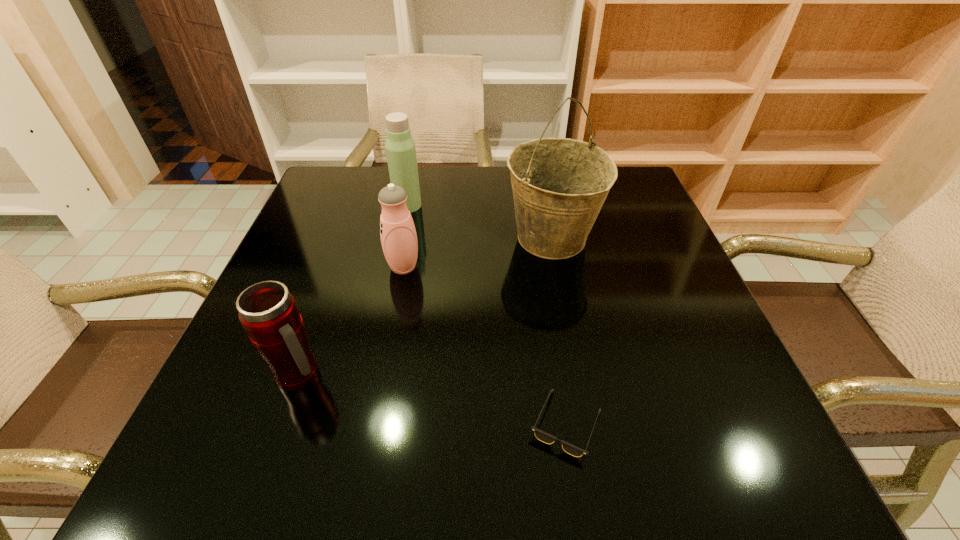
Where is `the tallest object`? The height and width of the screenshot is (540, 960). the tallest object is located at coordinates (559, 185).

I want to click on the farthest thermos bottle, so click(x=400, y=147).

I want to click on the second nearest thermos bottle, so click(398, 235).

Where is `the nearest thermos bottle`? This screenshot has height=540, width=960. the nearest thermos bottle is located at coordinates (268, 312).

Locate an element on the screen. the leftmost thermos bottle is located at coordinates (268, 312).

You are a GUI agent. You are given a task and a screenshot of the screen. Output one action in this format:
    pyautogui.click(x=<x>, y=<y>)
    Task: Click on the sunglasses
    
    Given the screenshot: What is the action you would take?
    pyautogui.click(x=573, y=450)

Find the location of a particular element. vacant region located 0.100m on the right of the tallest object is located at coordinates (642, 239).

Identify the location of vacant region located on the back of the farthest thermos bottle. (416, 169).

Find the location of `free space located on the back of the second farthest thermos bottle`. free space located on the back of the second farthest thermos bottle is located at coordinates (416, 204).

Locate an element on the screen. This screenshot has width=960, height=540. free space located on the side with the handle of the leftmost object is located at coordinates (502, 375).